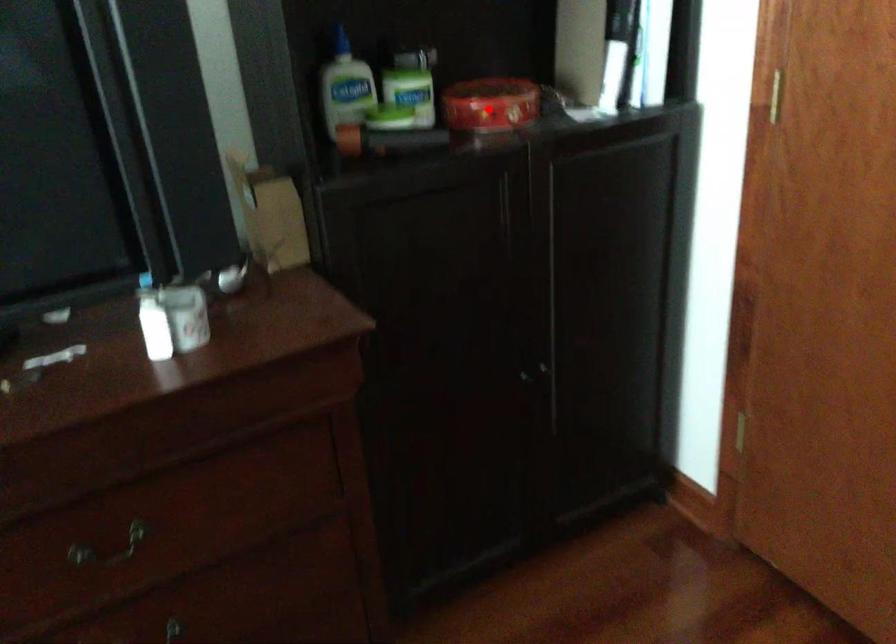
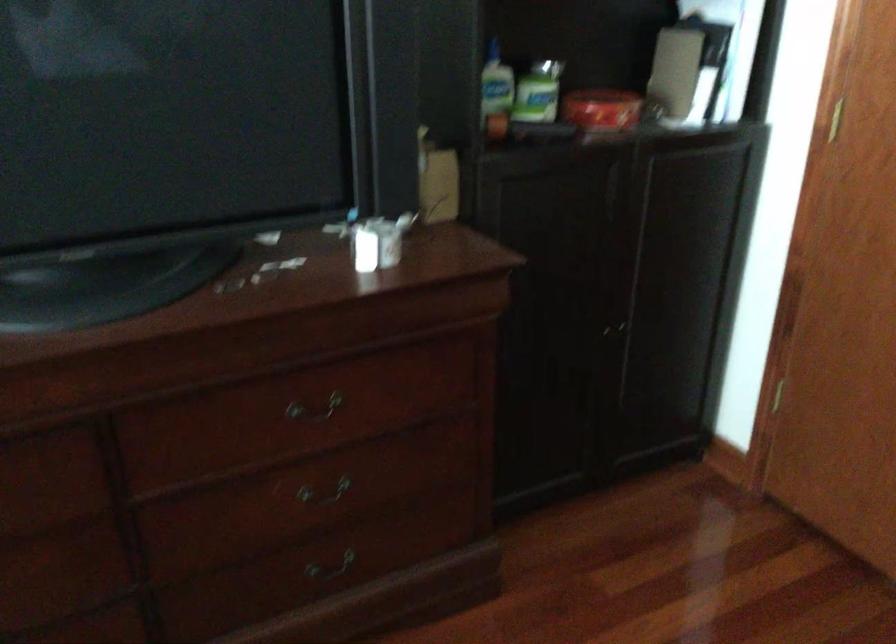
Question: I am providing you with two images of the same scene from different viewpoints. A red point is marked on the first image. Is the red point's position out of view in image 2?

Choices:
 (A) Yes
 (B) No

Answer: (B)